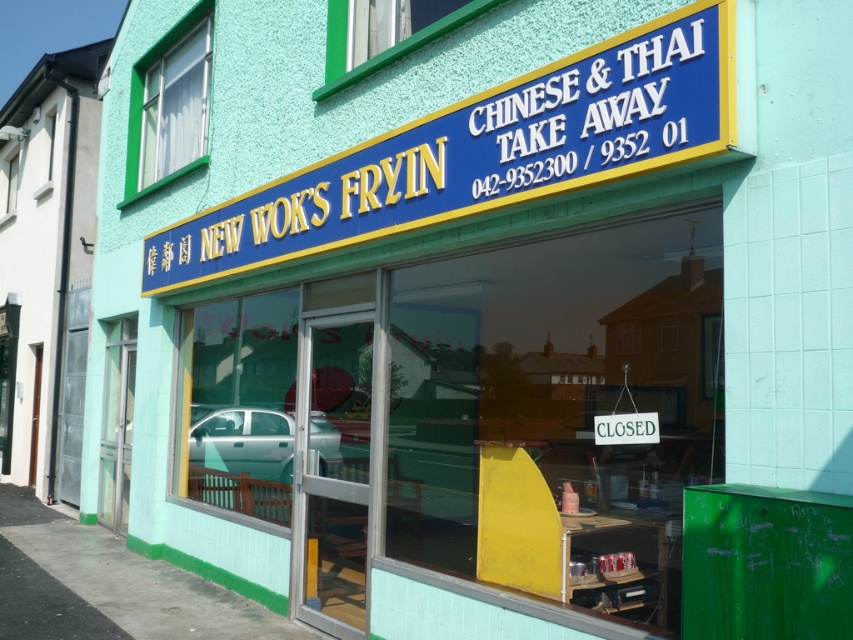
Is blue plastic sign at upper center wider than teal metallic car at center?

Yes, blue plastic sign at upper center is wider than teal metallic car at center.

Does blue plastic sign at upper center appear over teal metallic car at center?

Indeed, blue plastic sign at upper center is positioned over teal metallic car at center.

Which is behind, point (664, 54) or point (254, 436)?

Point (254, 436)

Image resolution: width=853 pixels, height=640 pixels. Find the location of `blue plastic sign at upper center`. blue plastic sign at upper center is located at coordinates (482, 150).